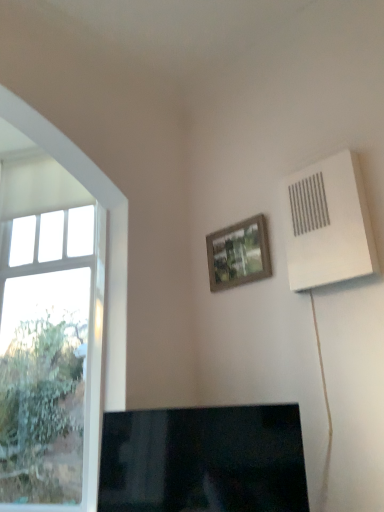
Question: Considering the relative sizes of black glossy tv at lower center and clear glass window at left in the image provided, is black glossy tv at lower center bigger than clear glass window at left?

Choices:
 (A) yes
 (B) no

Answer: (B)

Question: Can you confirm if black glossy tv at lower center is thinner than clear glass window at left?

Choices:
 (A) no
 (B) yes

Answer: (A)

Question: From the image's perspective, is black glossy tv at lower center below clear glass window at left?

Choices:
 (A) no
 (B) yes

Answer: (B)

Question: Considering the relative sizes of black glossy tv at lower center and clear glass window at left in the image provided, is black glossy tv at lower center shorter than clear glass window at left?

Choices:
 (A) yes
 (B) no

Answer: (A)

Question: From a real-world perspective, is black glossy tv at lower center on clear glass window at left?

Choices:
 (A) no
 (B) yes

Answer: (A)

Question: From their relative heights in the image, would you say black glossy tv at lower center is taller or shorter than wooden frame at upper center?

Choices:
 (A) tall
 (B) short

Answer: (A)

Question: Considering the positions of black glossy tv at lower center and wooden frame at upper center in the image, is black glossy tv at lower center wider or thinner than wooden frame at upper center?

Choices:
 (A) wide
 (B) thin

Answer: (A)

Question: Do you think black glossy tv at lower center is within wooden frame at upper center, or outside of it?

Choices:
 (A) outside
 (B) inside

Answer: (A)

Question: From the image's perspective, is black glossy tv at lower center above or below wooden frame at upper center?

Choices:
 (A) below
 (B) above

Answer: (A)

Question: From a real-world perspective, is white plastic air conditioning unit at upper right physically located above or below clear glass window at left?

Choices:
 (A) above
 (B) below

Answer: (A)

Question: Based on their sizes in the image, would you say white plastic air conditioning unit at upper right is bigger or smaller than clear glass window at left?

Choices:
 (A) small
 (B) big

Answer: (A)

Question: In the image, is white plastic air conditioning unit at upper right on the left side or the right side of clear glass window at left?

Choices:
 (A) right
 (B) left

Answer: (A)

Question: In terms of height, does white plastic air conditioning unit at upper right look taller or shorter compared to clear glass window at left?

Choices:
 (A) short
 (B) tall

Answer: (A)

Question: In the image, is clear glass window at left on the left side or the right side of white plastic air conditioning unit at upper right?

Choices:
 (A) right
 (B) left

Answer: (B)

Question: From a real-world perspective, is clear glass window at left physically located above or below white plastic air conditioning unit at upper right?

Choices:
 (A) below
 (B) above

Answer: (A)